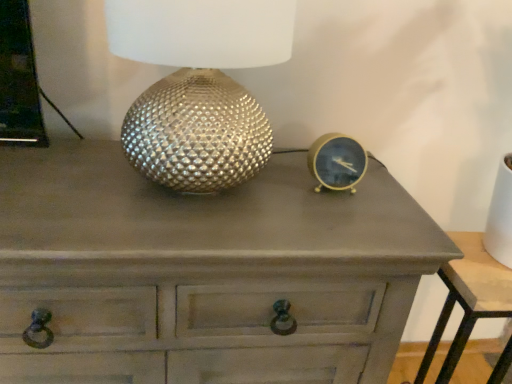
I want to click on empty space that is to the right of gold metallic clock at right, so click(x=389, y=202).